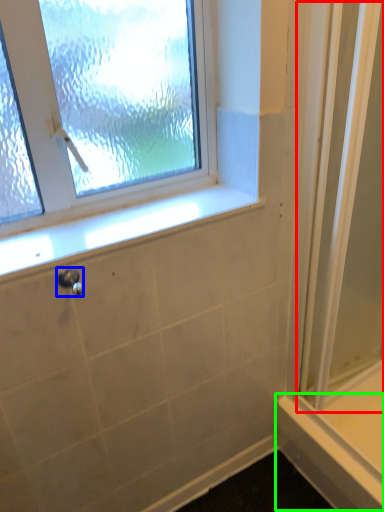
Question: Based on their relative distances, which object is farther from screen door (highlighted by a red box)? Choose from shower (highlighted by a blue box) and ledge (highlighted by a green box).

Choices:
 (A) shower
 (B) ledge

Answer: (A)